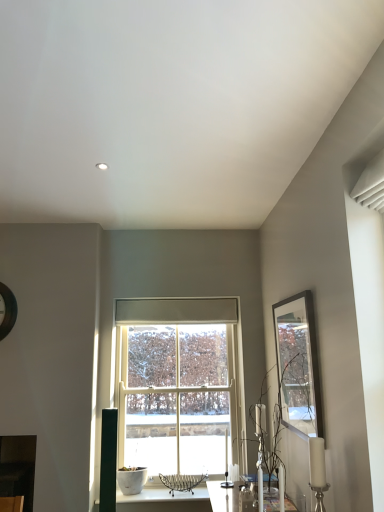
Question: Is white wooden window at center looking in the opposite direction of translucent glass vase at right?

Choices:
 (A) yes
 (B) no

Answer: (B)

Question: Is white wooden window at center wider than translucent glass vase at right?

Choices:
 (A) yes
 (B) no

Answer: (B)

Question: Does white wooden window at center have a larger size compared to translucent glass vase at right?

Choices:
 (A) yes
 (B) no

Answer: (A)

Question: Is white wooden window at center in contact with translucent glass vase at right?

Choices:
 (A) no
 (B) yes

Answer: (A)

Question: Does white wooden window at center appear on the right side of translucent glass vase at right?

Choices:
 (A) no
 (B) yes

Answer: (A)

Question: From a real-world perspective, is translucent glass vase at right positioned above or below white wooden window at center?

Choices:
 (A) above
 (B) below

Answer: (B)

Question: In terms of width, does translucent glass vase at right look wider or thinner when compared to white wooden window at center?

Choices:
 (A) thin
 (B) wide

Answer: (B)

Question: Is translucent glass vase at right taller or shorter than white wooden window at center?

Choices:
 (A) tall
 (B) short

Answer: (B)

Question: In the image, is translucent glass vase at right positioned in front of or behind white wooden window at center?

Choices:
 (A) behind
 (B) front

Answer: (B)

Question: In terms of size, does white wooden window at center appear bigger or smaller than translucent glass vase at right?

Choices:
 (A) small
 (B) big

Answer: (B)

Question: Looking at their shapes, would you say white wooden window at center is wider or thinner than translucent glass vase at right?

Choices:
 (A) thin
 (B) wide

Answer: (A)

Question: From the image's perspective, relative to translucent glass vase at right, is white wooden window at center above or below?

Choices:
 (A) above
 (B) below

Answer: (B)

Question: Does point (175, 468) appear closer or farther from the camera than point (278, 415)?

Choices:
 (A) closer
 (B) farther

Answer: (B)

Question: Considering the positions of point (279, 423) and point (299, 365), is point (279, 423) closer or farther from the camera than point (299, 365)?

Choices:
 (A) farther
 (B) closer

Answer: (A)

Question: Based on their positions, is translucent glass vase at right located to the left or right of matte black picture frame at upper right?

Choices:
 (A) left
 (B) right

Answer: (A)